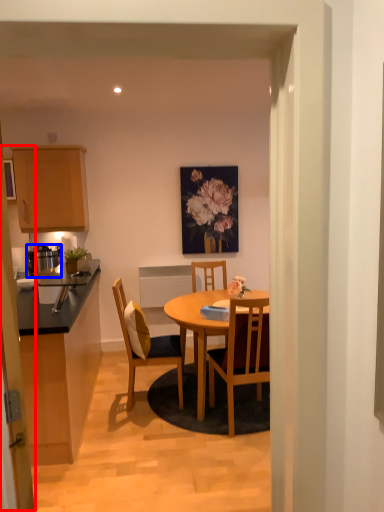
Question: Which object is further to the camera taking this photo, glass door (highlighted by a red box) or appliance (highlighted by a blue box)?

Choices:
 (A) glass door
 (B) appliance

Answer: (B)